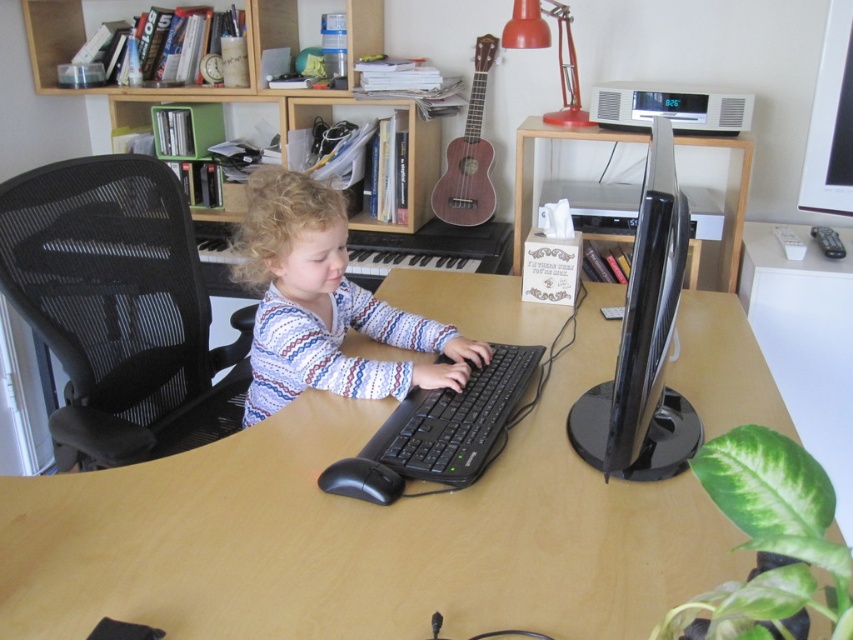
Is point (32, 477) farther from camera compared to point (379, 381)?

No, (32, 477) is in front of (379, 381).

Which is behind, point (495, 472) or point (424, 321)?

The point (424, 321) is behind.

Find the location of a particular element. wooden table at center is located at coordinates (363, 534).

Is black mesh chair at left wider than white textured sweater at center?

Incorrect, black mesh chair at left's width does not surpass white textured sweater at center's.

Is black mesh chair at left smaller than white textured sweater at center?

Actually, black mesh chair at left might be larger than white textured sweater at center.

Which is in front, point (126, 323) or point (305, 250)?

Point (305, 250) is more forward.

Where is `black mesh chair at left`? black mesh chair at left is located at coordinates tap(119, 308).

Is point (637, 424) positioned behind point (515, 356)?

No, it is not.

Who is higher up, black glossy monitor at center right or black plastic keyboard at center?

black glossy monitor at center right is above.

Find the location of a particular element. This screenshot has width=853, height=640. black glossy monitor at center right is located at coordinates (643, 342).